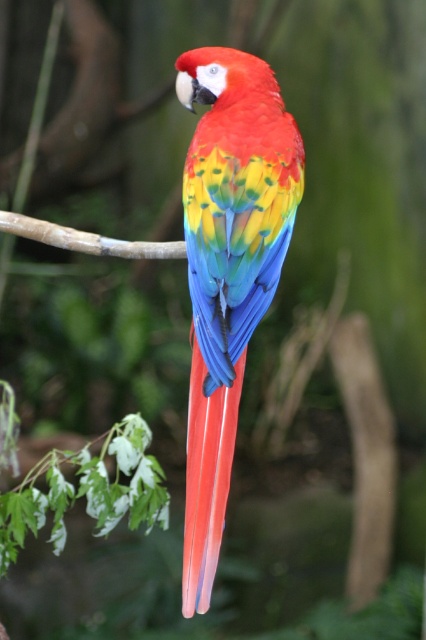
Question: Which object is closer to the camera taking this photo?

Choices:
 (A) glossy feathers parrot at center
 (B) brown smooth branch at center

Answer: (A)

Question: Which object is closer to the camera taking this photo?

Choices:
 (A) glossy feathers parrot at center
 (B) brown smooth branch at center

Answer: (A)

Question: Is glossy feathers parrot at center above brown smooth branch at center?

Choices:
 (A) yes
 (B) no

Answer: (B)

Question: Can you confirm if glossy feathers parrot at center is positioned above brown smooth branch at center?

Choices:
 (A) yes
 (B) no

Answer: (B)

Question: Can you confirm if glossy feathers parrot at center is thinner than brown smooth branch at center?

Choices:
 (A) no
 (B) yes

Answer: (B)